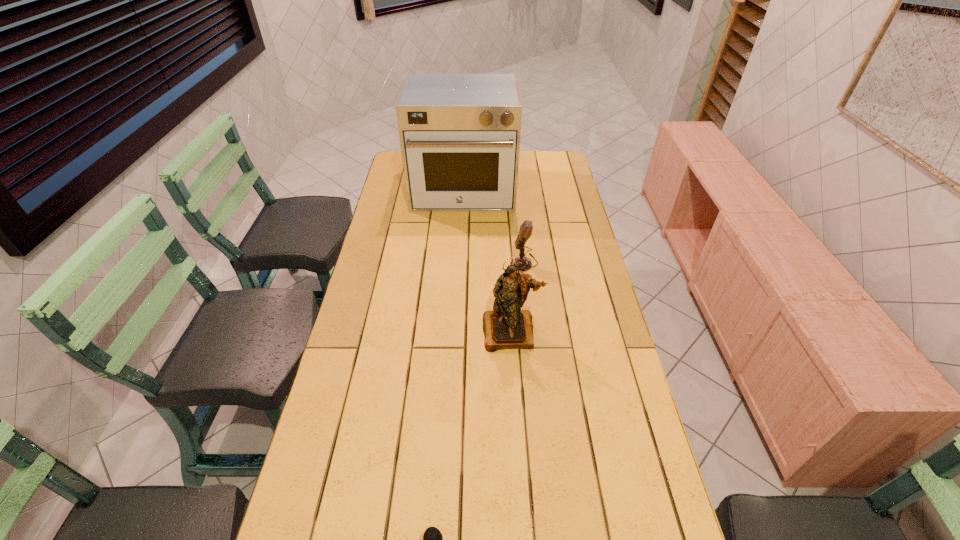
Where is `blank area located on the front-facing side of the right microphone`? This screenshot has height=540, width=960. blank area located on the front-facing side of the right microphone is located at coordinates click(414, 262).

The height and width of the screenshot is (540, 960). I want to click on object that is at the far edge, so click(459, 134).

The width and height of the screenshot is (960, 540). What are the coordinates of `object present at the left edge` in the screenshot? It's located at (459, 134).

This screenshot has width=960, height=540. In order to click on object situated at the far left corner in this screenshot , I will do `click(459, 134)`.

In the image, there is a desktop. Where is `free space at the far edge`? free space at the far edge is located at coordinates (521, 172).

Locate an element on the screen. free space at the left edge is located at coordinates (324, 507).

In order to click on vacant space at the right edge in this screenshot , I will do `click(567, 292)`.

At what (x,y) coordinates should I click in order to perform the action: click on vacant point located between the figurine and the toaster oven. Please return your answer as a coordinate pair (x, y). This screenshot has width=960, height=540. Looking at the image, I should click on (487, 261).

At what (x,y) coordinates should I click in order to perform the action: click on free space between the second tallest object and the tallest object. Please return your answer as a coordinate pair (x, y). Image resolution: width=960 pixels, height=540 pixels. Looking at the image, I should click on (487, 261).

In order to click on unoccupied area between the tallest object and the third shortest object in this screenshot , I will do `click(487, 261)`.